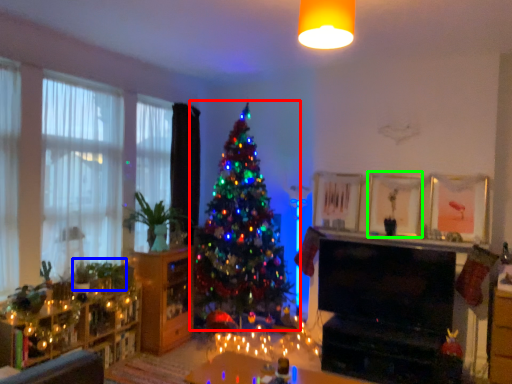
Question: Which object is positioned farthest from christmas tree (highlighted by a red box)? Select from plant (highlighted by a blue box) and picture frame (highlighted by a green box).

Choices:
 (A) plant
 (B) picture frame

Answer: (B)